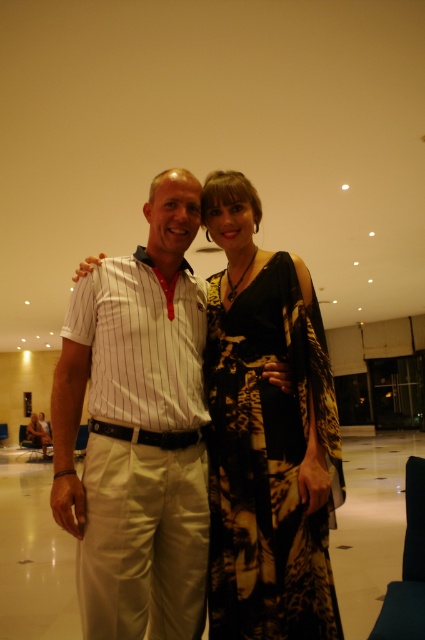
Between white striped shirt at center and black printed dress at center, which one has more height?

white striped shirt at center

Is the position of white striped shirt at center less distant than that of black printed dress at center?

Yes, it is in front of black printed dress at center.

Between point (101, 360) and point (223, 554), which one is positioned in front?

Point (223, 554)

Find the location of `white striped shirt at center`. white striped shirt at center is located at coordinates (138, 429).